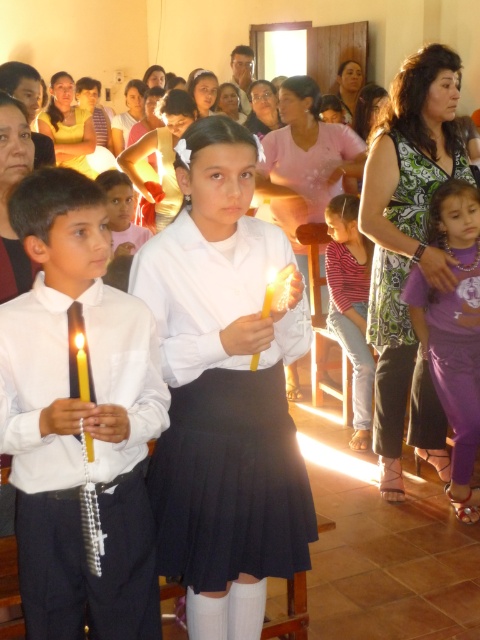
You are standing in the church and want to place a small decoration exactly at the center of the room. The center is marked by the coordinates point 0.5, 0.5. Where should you place the decoration relative to the matte white shirt at center?

The matte white shirt at center is located at point (79,420), which is to the right and below the true center of the room at point (240,320). Therefore, you should place the decoration to the left and above the matte white shirt at center to reach the true center.

You are an interior designer planning to place a decorative item next to the purple satin dress at lower right and the yellow wax candle at center. Considering their sizes, which object should you place the larger decorative item next to?

The purple satin dress at lower right is wider than the yellow wax candle at center, so you should place the larger decorative item next to the purple satin dress at lower right.

You are a photographer setting up for an event in this room. You need to place a tripod so that both the purple satin dress at lower right and the yellow wax candle at center are visible in the frame. Considering their positions, where should you position the tripod?

The yellow wax candle at center is behind the purple satin dress at lower right, so positioning the tripod in front of the purple satin dress at lower right would allow both objects to be visible in the frame.